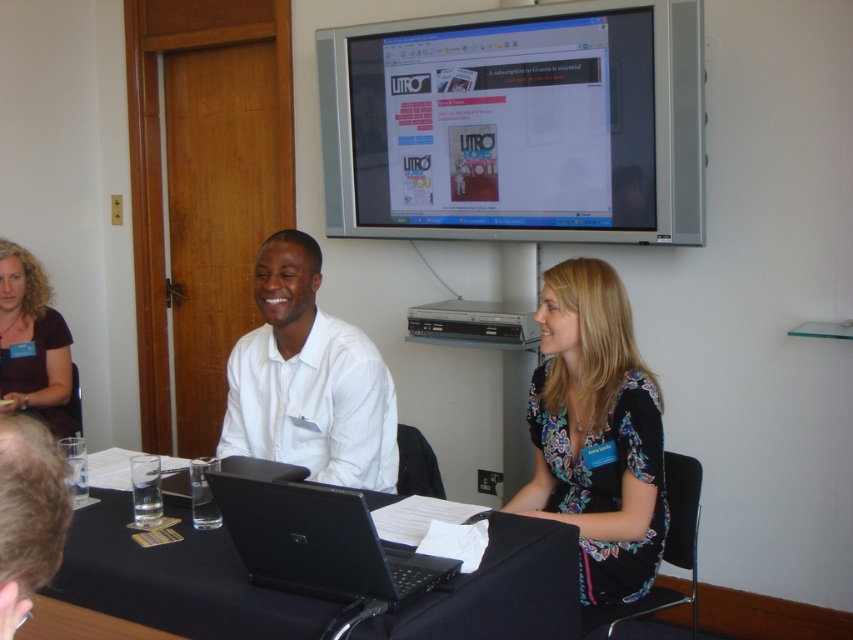
Question: Is matte plastic monitor at upper center above black fabric table at lower center?

Choices:
 (A) no
 (B) yes

Answer: (B)

Question: From the image, what is the correct spatial relationship of black fabric table at lower center in relation to floral fabric dress at center?

Choices:
 (A) left
 (B) right

Answer: (A)

Question: Does black fabric table at lower center have a larger size compared to black plastic laptop at center?

Choices:
 (A) yes
 (B) no

Answer: (A)

Question: Which point is farther from the camera taking this photo?

Choices:
 (A) (550, 323)
 (B) (619, 198)
 (C) (250, 378)
 (D) (12, 269)

Answer: (D)

Question: Which of the following is the closest to the observer?

Choices:
 (A) black plastic laptop at center
 (B) black fabric table at lower center
 (C) black glossy laptop at center

Answer: (C)

Question: Which of the following is the closest to the observer?

Choices:
 (A) black fabric table at lower center
 (B) black glossy laptop at center

Answer: (B)